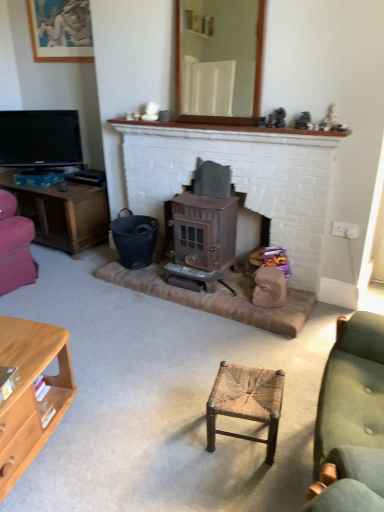
Where is `free space above white painted wood mantle at upper center (from a real-world perspective)`? This screenshot has width=384, height=512. free space above white painted wood mantle at upper center (from a real-world perspective) is located at coordinates (232, 122).